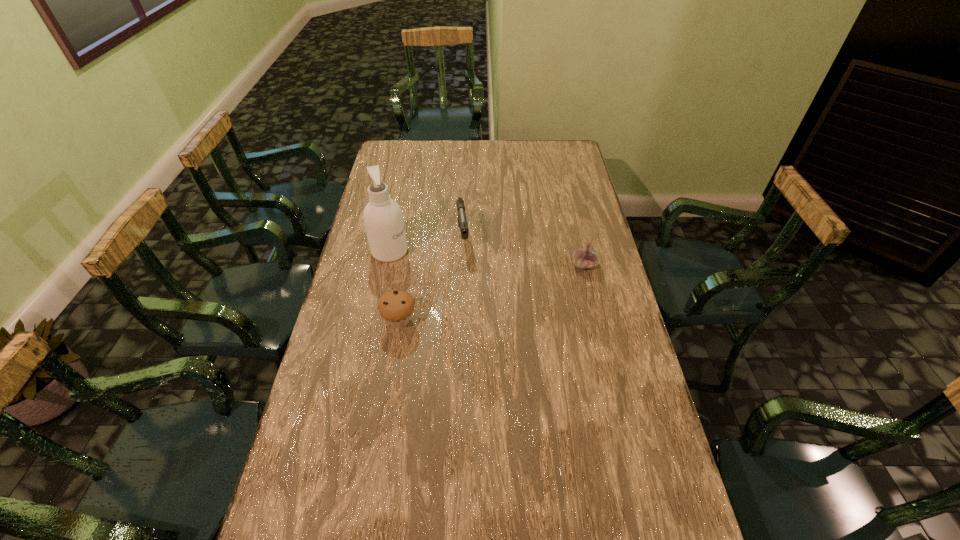
Find the location of a particular element. object that stands as the second closest to the cleansing agent is located at coordinates (396, 307).

Where is `object that stands as the second closest to the muffin`? The image size is (960, 540). object that stands as the second closest to the muffin is located at coordinates (462, 219).

This screenshot has height=540, width=960. Find the location of `vacant space that satisfies the following two spatial constraints: 1. on the front side of the cleansing agent; 2. on the left side of the nearest object`. vacant space that satisfies the following two spatial constraints: 1. on the front side of the cleansing agent; 2. on the left side of the nearest object is located at coordinates (375, 320).

This screenshot has width=960, height=540. I want to click on free spot that satisfies the following two spatial constraints: 1. on the front side of the muffin; 2. on the right side of the cleansing agent, so click(x=375, y=320).